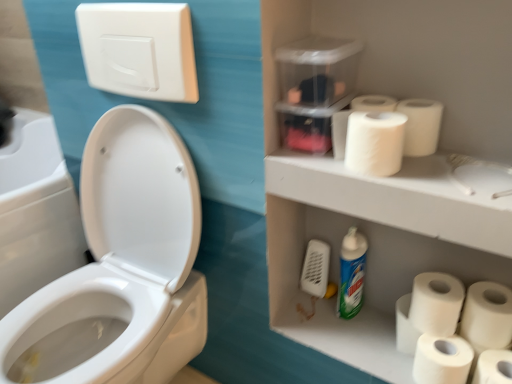
Question: Does white matte toilet paper at lower right, positioned as the 4th toilet paper in top-to-bottom order, have a lesser width compared to white matte toilet paper at lower right, the 3th toilet paper when ordered from top to bottom?

Choices:
 (A) no
 (B) yes

Answer: (B)

Question: Can you confirm if white matte toilet paper at lower right, positioned as the 4th toilet paper in top-to-bottom order, is smaller than white matte toilet paper at lower right, the 3th toilet paper when ordered from top to bottom?

Choices:
 (A) yes
 (B) no

Answer: (A)

Question: From a real-world perspective, is white matte toilet paper at lower right, the 3th toilet paper ordered from the bottom, physically above white matte toilet paper at lower right, the 3th toilet paper when ordered from top to bottom?

Choices:
 (A) yes
 (B) no

Answer: (A)

Question: Is white matte toilet paper at lower right, which appears as the fourth toilet paper when ordered from the bottom, located within white matte toilet paper at lower right, positioned as the 4th toilet paper in top-to-bottom order?

Choices:
 (A) yes
 (B) no

Answer: (B)

Question: Is white matte toilet paper at lower right, the 3th toilet paper ordered from the bottom, not within white matte toilet paper at lower right, the 3th toilet paper when ordered from top to bottom?

Choices:
 (A) yes
 (B) no

Answer: (A)

Question: From a real-world perspective, is white glossy cleaning product at lower center above or below white matte toilet paper at lower right, acting as the second toilet paper starting from the bottom?

Choices:
 (A) below
 (B) above

Answer: (B)

Question: Visually, is white glossy cleaning product at lower center positioned to the left or to the right of white matte toilet paper at lower right, the 5th toilet paper when ordered from top to bottom?

Choices:
 (A) left
 (B) right

Answer: (A)

Question: Looking at the image, does white glossy cleaning product at lower center seem bigger or smaller compared to white matte toilet paper at lower right, the 5th toilet paper when ordered from top to bottom?

Choices:
 (A) big
 (B) small

Answer: (A)

Question: In terms of width, does white glossy cleaning product at lower center look wider or thinner when compared to white matte toilet paper at lower right, the 5th toilet paper when ordered from top to bottom?

Choices:
 (A) wide
 (B) thin

Answer: (B)

Question: Considering the positions of point (437, 130) and point (336, 309), is point (437, 130) closer or farther from the camera than point (336, 309)?

Choices:
 (A) farther
 (B) closer

Answer: (B)

Question: Is white matte toilet paper at upper right, the 1th toilet paper from the top, bigger or smaller than white glossy cleaning product at lower center?

Choices:
 (A) big
 (B) small

Answer: (B)

Question: From the image's perspective, is white matte toilet paper at upper right, which ranks as the sixth toilet paper in bottom-to-top order, positioned above or below white glossy cleaning product at lower center?

Choices:
 (A) above
 (B) below

Answer: (A)

Question: In terms of width, does white matte toilet paper at upper right, which ranks as the sixth toilet paper in bottom-to-top order, look wider or thinner when compared to white glossy cleaning product at lower center?

Choices:
 (A) thin
 (B) wide

Answer: (A)

Question: In terms of size, does white matte toilet paper at lower right, positioned as the 4th toilet paper in top-to-bottom order, appear bigger or smaller than white matte toilet paper at upper right, which appears as the 2th toilet paper when viewed from the top?

Choices:
 (A) big
 (B) small

Answer: (A)

Question: Considering the relative positions of white matte toilet paper at lower right, positioned as the 4th toilet paper in top-to-bottom order, and white matte toilet paper at upper right, which appears as the 2th toilet paper when viewed from the top, in the image provided, is white matte toilet paper at lower right, positioned as the 4th toilet paper in top-to-bottom order, to the left or to the right of white matte toilet paper at upper right, which appears as the 2th toilet paper when viewed from the top,?

Choices:
 (A) left
 (B) right

Answer: (B)